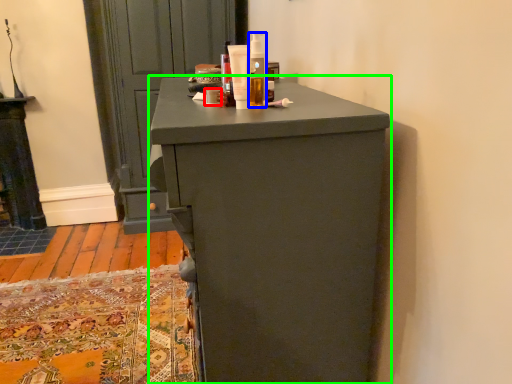
Question: Considering the real-world distances, which object is farthest from toiletry (highlighted by a red box)? toiletry (highlighted by a blue box) or chest of drawers (highlighted by a green box)?

Choices:
 (A) toiletry
 (B) chest of drawers

Answer: (B)